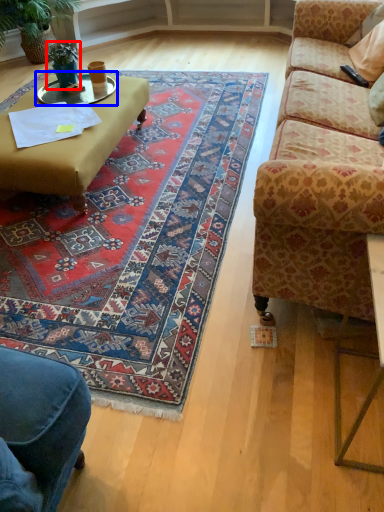
Question: Which object appears farthest to the camera in this image, houseplant (highlighted by a red box) or glass table (highlighted by a blue box)?

Choices:
 (A) houseplant
 (B) glass table

Answer: (A)